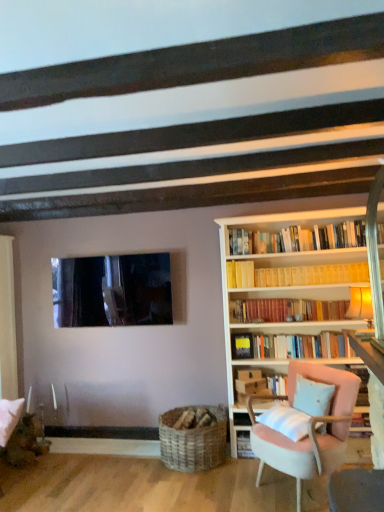
Find the location of `blank space above yellow paperbacks at upper center, acting as the first book starting from the top (from a real-world perspective)`. blank space above yellow paperbacks at upper center, acting as the first book starting from the top (from a real-world perspective) is located at coordinates (313, 265).